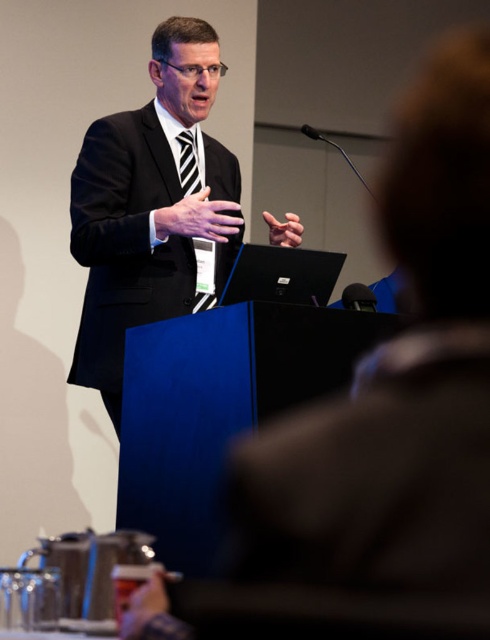
What is the location of the point with coordinates (150, 208) in the image?

The point with coordinates (150, 208) is located on the black matte suit at center.

You are attending a presentation and notice the speaker wearing a black matte suit at center and a black striped tie at center. Can you determine which clothing item is closer to the audience based on their positions?

The black matte suit at center is in front of the black striped tie at center, so the black matte suit at center is closer to the audience.

You are an event organizer who needs to ensure the speaker is properly dressed for the event. Based on the image, is the black striped tie at center positioned correctly relative to the black matte suit at center?

The black striped tie at center is positioned above the black matte suit at center, which is correct as ties are typically worn over the shirt and under the jacket, so the positioning aligns with proper attire.